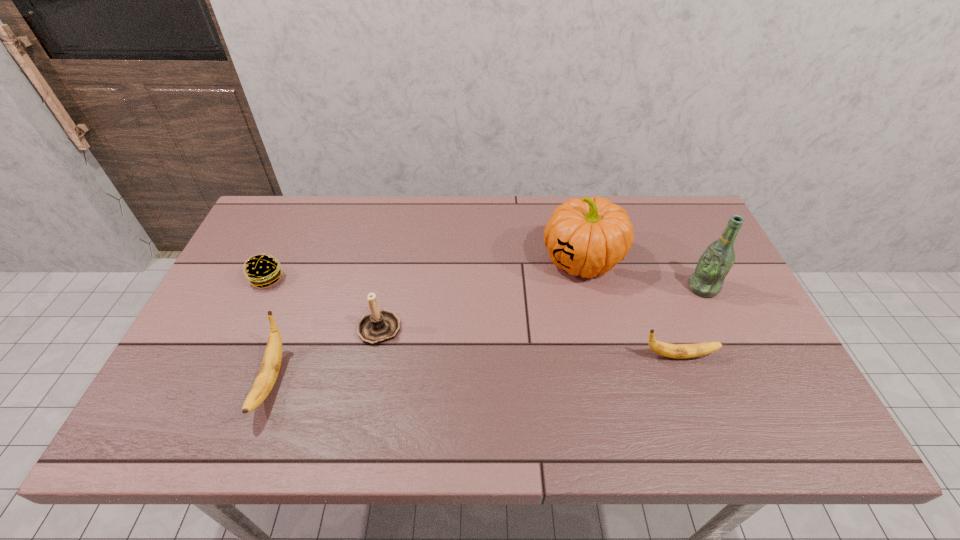
The width and height of the screenshot is (960, 540). What are the coordinates of `vacant area that lies between the fifth object from right to left and the right banana` in the screenshot? It's located at (474, 368).

Where is `free space between the taller banana and the third object from left to right`? The image size is (960, 540). free space between the taller banana and the third object from left to right is located at coordinates tap(325, 354).

Where is `vacant area between the leftmost object and the rightmost object`? The image size is (960, 540). vacant area between the leftmost object and the rightmost object is located at coordinates (485, 284).

Find the location of a particular element. vacant space in between the candle holder and the rightmost object is located at coordinates (541, 307).

I want to click on empty location between the pumpkin and the left banana, so click(x=426, y=320).

Where is `free space between the right banana and the pumpkin`? The image size is (960, 540). free space between the right banana and the pumpkin is located at coordinates (630, 308).

I want to click on unoccupied area between the leftmost object and the taller banana, so 269,329.

You are a GUI agent. You are given a task and a screenshot of the screen. Output one action in this format:
    pyautogui.click(x=<x>, y=<y>)
    Task: Click on the empty space that is in between the candle holder and the right banana
    
    Given the screenshot: What is the action you would take?
    pyautogui.click(x=529, y=341)

I want to click on the closest object relative to the rightmost object, so click(x=588, y=236).

Locate which object ranks fourth in proximity to the leftmost object. Please provide its 2D coordinates. Your answer should be formatted as a tuple, i.e. [(x, y)], where the tuple contains the x and y coordinates of a point satisfying the conditions above.

[(680, 351)]